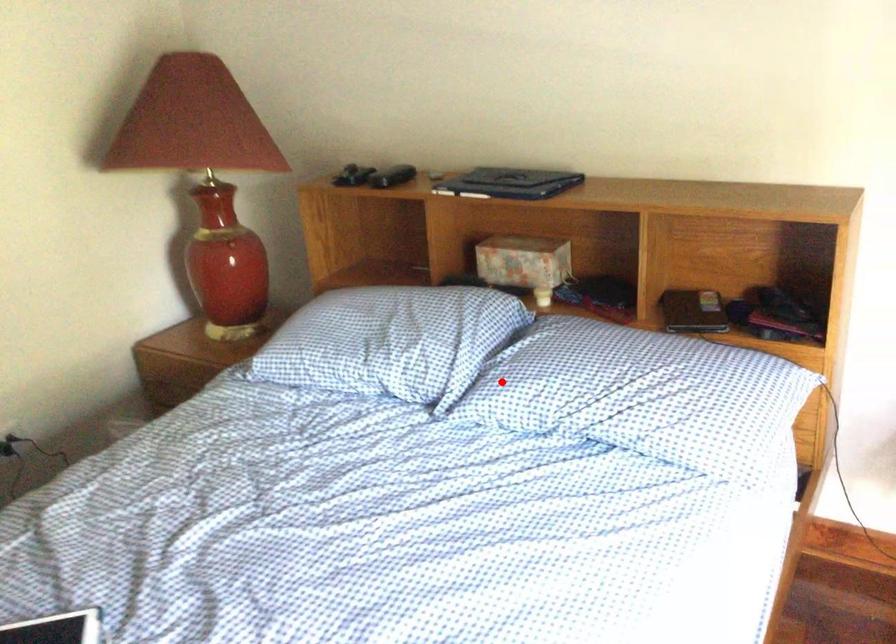
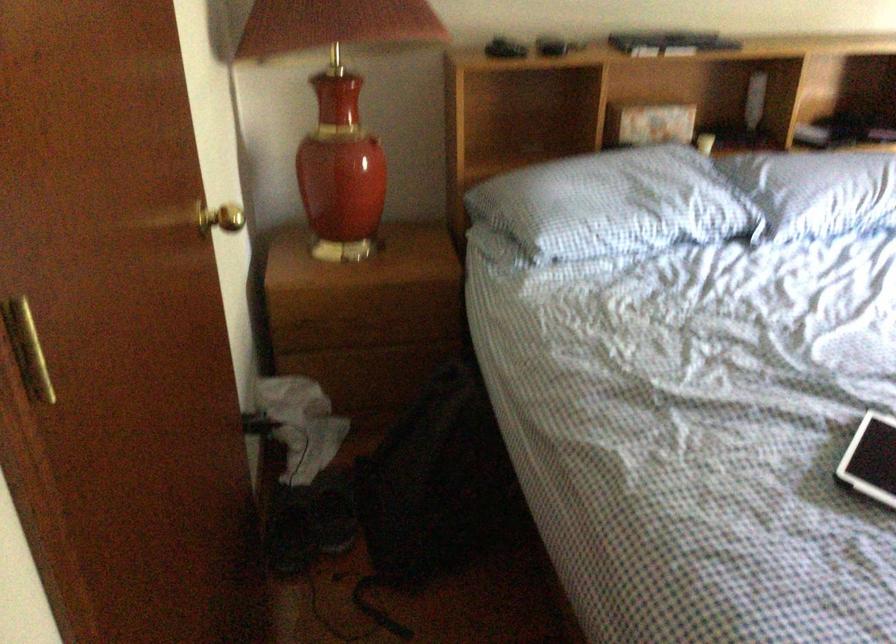
In the second image, find the point that corresponds to the highlighted location in the first image.

(817, 191)